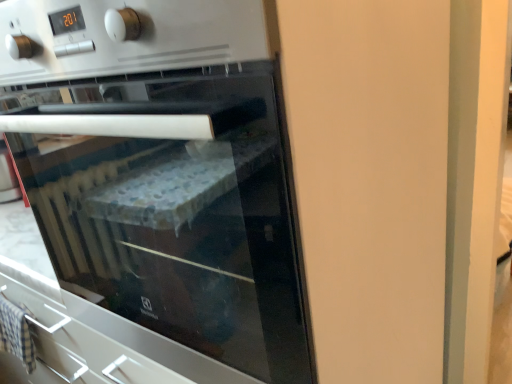
Find the location of a particular element. This screenshot has height=384, width=512. white glossy oven at center is located at coordinates (163, 168).

What do you see at coordinates (163, 168) in the screenshot? I see `white glossy oven at center` at bounding box center [163, 168].

This screenshot has height=384, width=512. What are the coordinates of `white glossy oven at center` in the screenshot? It's located at (163, 168).